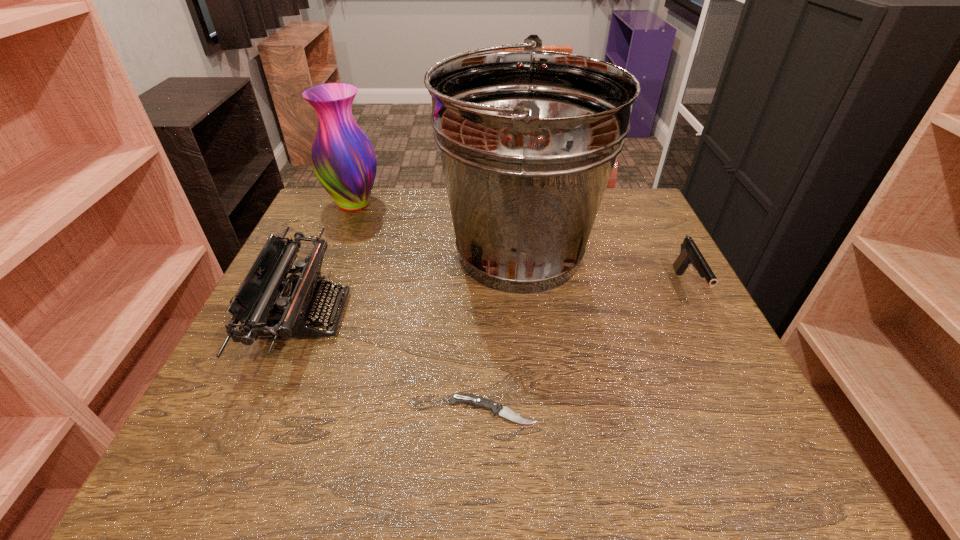
You are a GUI agent. You are given a task and a screenshot of the screen. Output one action in this format:
    pyautogui.click(x=<x>, y=<y>)
    Task: Click on the free space at the near edge
    The width and height of the screenshot is (960, 540).
    Given the screenshot: What is the action you would take?
    pyautogui.click(x=440, y=448)

Identify the location of free spot at the left edge of the desktop. [310, 251].

Image resolution: width=960 pixels, height=540 pixels. Identify the location of free space at the right edge. (611, 246).

Find the location of `free region at the far left corner of the desktop`. free region at the far left corner of the desktop is located at coordinates (329, 214).

Image resolution: width=960 pixels, height=540 pixels. In order to click on free space at the near left corner of the desktop in this screenshot , I will do `click(232, 429)`.

Where is `free space at the far right corner`? The width and height of the screenshot is (960, 540). free space at the far right corner is located at coordinates (639, 189).

Locate an element on the screen. vacant space at the near right corner of the desktop is located at coordinates (683, 427).

At what (x,y) coordinates should I click in order to perform the action: click on blank region between the nearest object and the pistol. Please return your answer as a coordinate pair (x, y). Looking at the image, I should click on (589, 349).

Find the location of a particular element. This screenshot has width=960, height=540. unoccupied area between the tallest object and the vase is located at coordinates (436, 228).

Locate an element on the screen. vacant area that lies between the bucket and the vase is located at coordinates (436, 228).